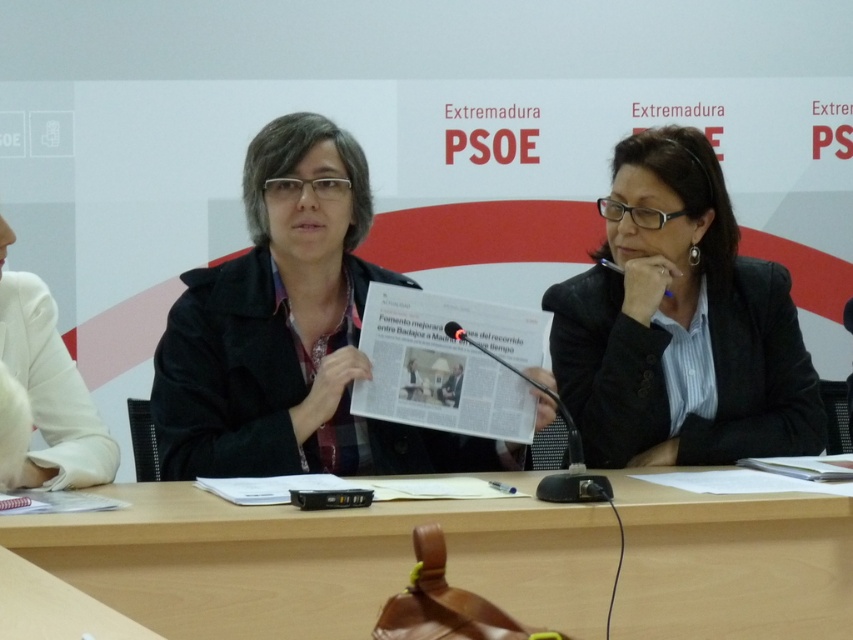
You are attending a press conference and notice two items on the table. The black matte blazer at center and the white fabric sleeve at left. Which one takes up more space on the table?

The black matte blazer at center takes up more space on the table as it is bigger than the white fabric sleeve at left.

You are a photographer standing at the back of the room where the press conference is taking place. You want to take a clear photo of the wooden table at center. Given that you are 10 feet away from the table, will you be able to capture the entire table in your shot?

The wooden table at center is 4.52 feet away from the camera. Since you are 10 feet away from the table, you are too far to capture the entire table in your shot.

You are standing in the room where the press conference is taking place. You need to place a large banner on the table. Where exactly should you place it on the wooden table at center?

The wooden table at center is located at point (317, 561), so you should place the banner there.